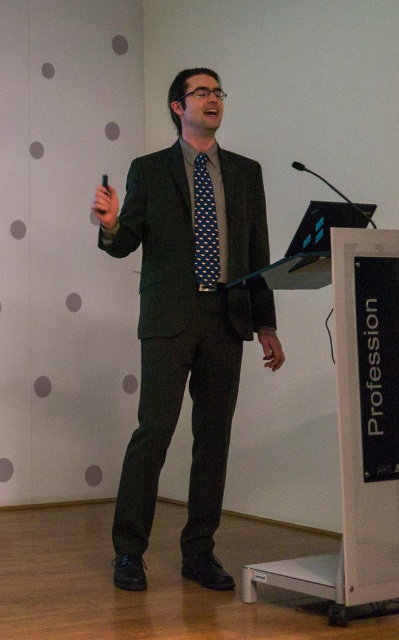
You are an attendee at the presentation. You notice two points marked in the image. The first point is at coordinates point (203,152) and the second at point (351,202). Which point is closer to the audience?

Point (351,202) is closer to the audience because it is in front of point (203,152).

Looking at this image, you are an event planner setting up a stage for a presentation. The stage has a podium on the right side. Where should you place the matte black suit at center so that it aligns with the podium?

The matte black suit at center should be positioned at point (187, 323) to align with the podium.

You are an event coordinator checking the stage setup. You notice the blue dotted tie at center and the black metallic microphone at upper right. Which object is larger?

The blue dotted tie at center is smaller than the black metallic microphone at upper right, so the black metallic microphone at upper right is larger.